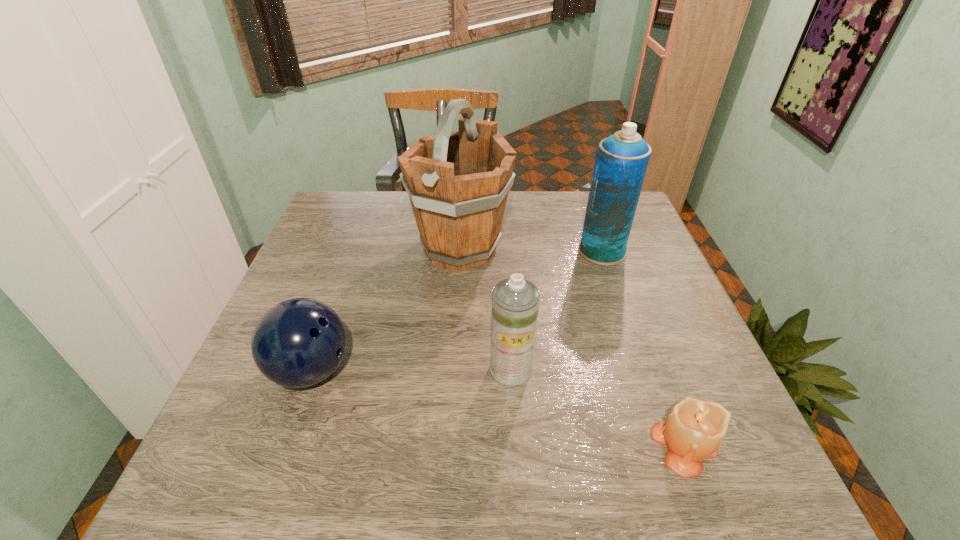
You are a GUI agent. You are given a task and a screenshot of the screen. Output one action in this format:
    pyautogui.click(x=<x>, y=<y>)
    Task: Click on the vacant region between the taller aerosol can and the third shortest object
    This screenshot has height=540, width=960.
    Given the screenshot: What is the action you would take?
    pyautogui.click(x=557, y=310)

Locate an element on the screen. The image size is (960, 540). free space that is in between the bucket and the nearest object is located at coordinates [x=572, y=346].

Locate an element on the screen. The image size is (960, 540). empty location between the right aerosol can and the second shortest object is located at coordinates (457, 310).

The width and height of the screenshot is (960, 540). In order to click on free space between the right aerosol can and the fourth tallest object in this screenshot , I will do `click(457, 310)`.

Identify the location of object that can be found as the fourth closest to the nearest object. (297, 343).

Locate which object ranks second in proximity to the bucket. Please provide its 2D coordinates. Your answer should be formatted as a tuple, i.e. [(x, y)], where the tuple contains the x and y coordinates of a point satisfying the conditions above.

[(297, 343)]

The width and height of the screenshot is (960, 540). I want to click on vacant position in the image that satisfies the following two spatial constraints: 1. on the surface of the second shortest object near the finger holes; 2. on the back side of the shortest object, so click(x=285, y=444).

Locate an element on the screen. This screenshot has height=540, width=960. blank space that satisfies the following two spatial constraints: 1. on the front side of the nearest object; 2. on the right side of the bucket is located at coordinates (449, 444).

Find the location of a particular element. vacant point that satisfies the following two spatial constraints: 1. on the front side of the shorter aerosol can; 2. on the right side of the candle is located at coordinates (516, 444).